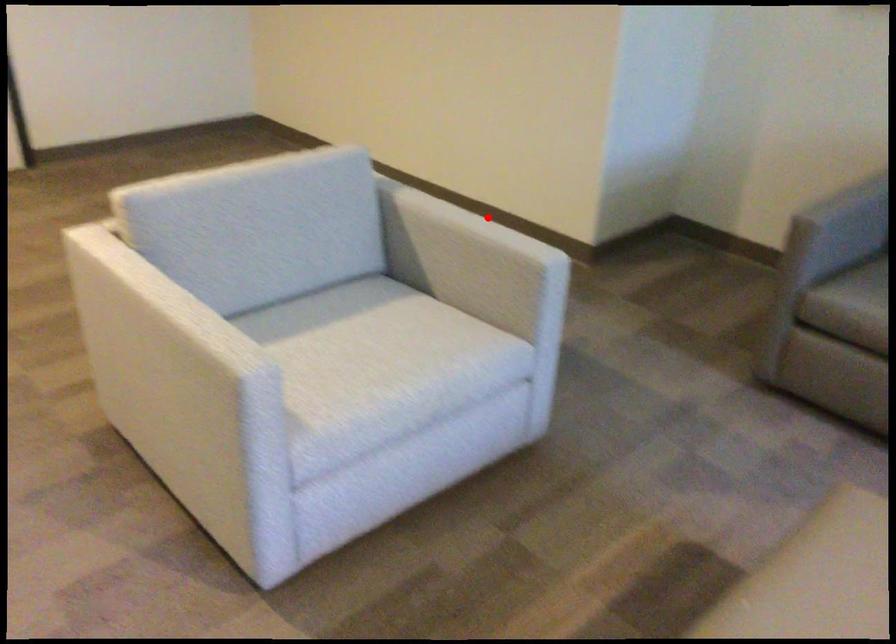
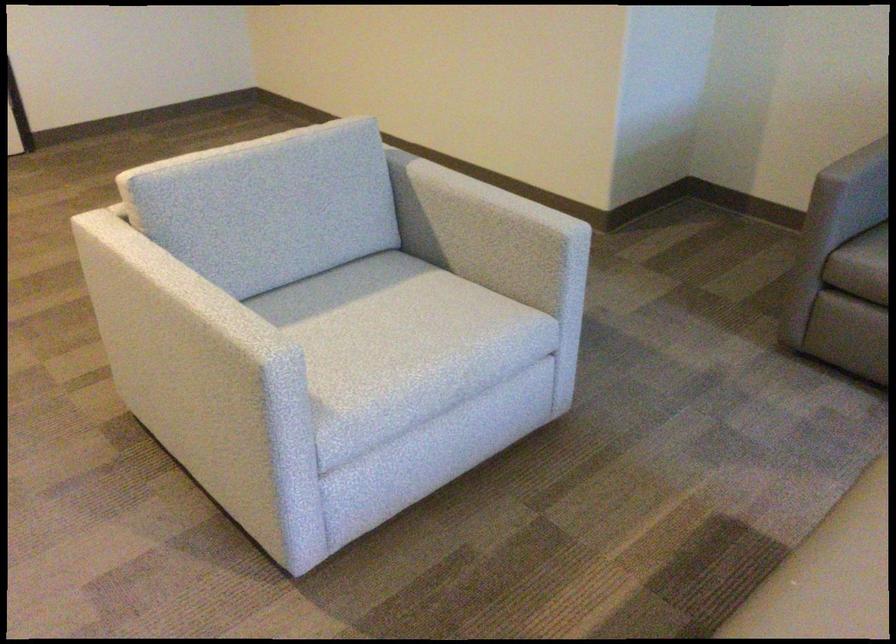
Locate, in the second image, the point that corresponds to the highlighted location in the first image.

(496, 180)